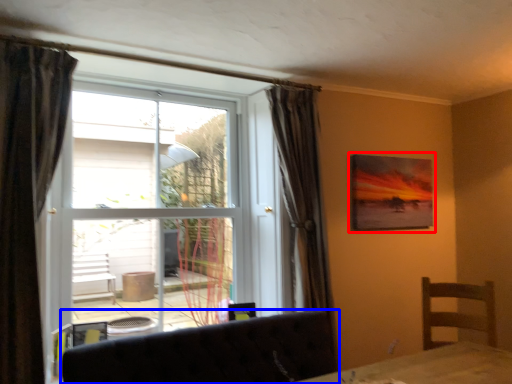
Question: Which object appears closest to the camera in this image, picture frame (highlighted by a red box) or furniture (highlighted by a blue box)?

Choices:
 (A) picture frame
 (B) furniture

Answer: (B)